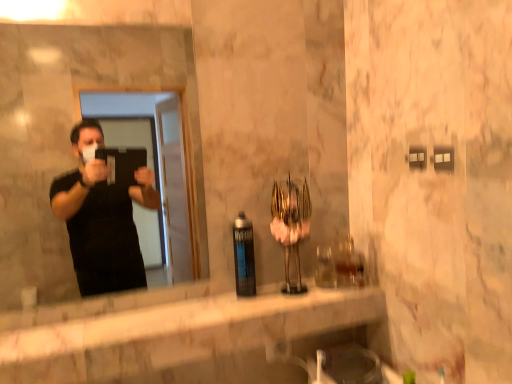
Question: Is point (167, 380) positioned closer to the camera than point (240, 241)?

Choices:
 (A) farther
 (B) closer

Answer: (A)

Question: From a real-world perspective, relative to matte black spray can at center, is white marble counter at center vertically above or below?

Choices:
 (A) below
 (B) above

Answer: (A)

Question: Which object is positioned closest to the white marble counter at center?

Choices:
 (A) matte black spray can at center
 (B) matte black mirror at left

Answer: (A)

Question: Based on their relative distances, which object is farther from the white marble counter at center?

Choices:
 (A) matte black mirror at left
 (B) matte black spray can at center

Answer: (A)